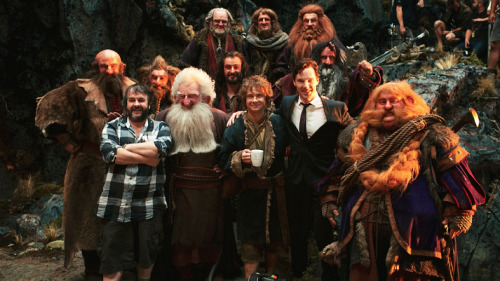
Where is `white mug`? This screenshot has width=500, height=281. white mug is located at coordinates (257, 158).